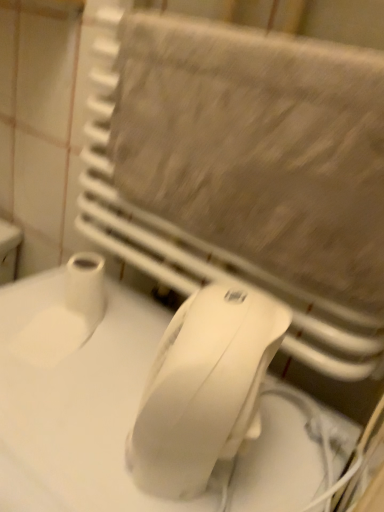
Identify the location of free space that is to the left of white matte toilet paper at lower left. (29, 300).